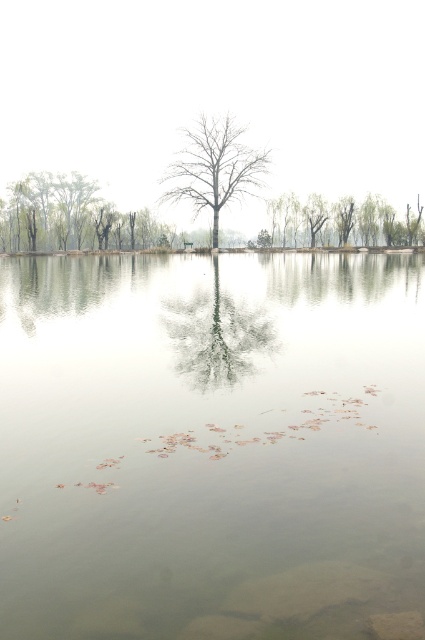
Question: Considering the real-world distances, which object is farthest from the bare wood tree at center?

Choices:
 (A) green leafy tree at center
 (B) green matte tree at left

Answer: (B)

Question: Which of the following is the closest to the observer?

Choices:
 (A) clear water at center
 (B) bare wood tree at center
 (C) green leafy tree at center
 (D) green matte tree at left

Answer: (A)

Question: Is green matte tree at left further to the viewer compared to green leafy tree at center?

Choices:
 (A) yes
 (B) no

Answer: (A)

Question: Considering the real-world distances, which object is farthest from the green matte tree at left?

Choices:
 (A) bare wood tree at center
 (B) clear water at center
 (C) green leafy tree at center

Answer: (B)

Question: Is clear water at center to the left of green leafy tree at center from the viewer's perspective?

Choices:
 (A) no
 (B) yes

Answer: (B)

Question: Where is clear water at center located in relation to bare wood tree at center in the image?

Choices:
 (A) left
 (B) right

Answer: (B)